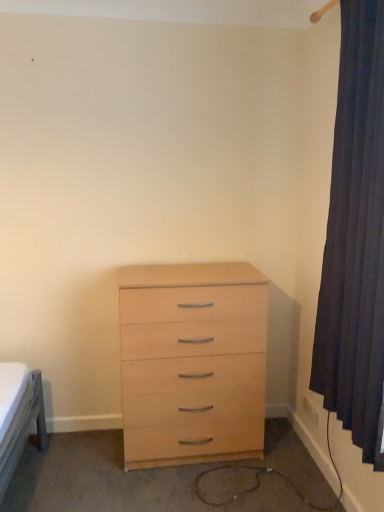
Question: Is light wood chest of drawers at center in front of or behind dark blue fabric curtain at right in the image?

Choices:
 (A) front
 (B) behind

Answer: (B)

Question: From the image's perspective, is light wood chest of drawers at center above or below dark blue fabric curtain at right?

Choices:
 (A) above
 (B) below

Answer: (B)

Question: From a real-world perspective, is light wood chest of drawers at center above or below dark blue fabric curtain at right?

Choices:
 (A) above
 (B) below

Answer: (B)

Question: From the image's perspective, relative to light wood chest of drawers at center, is dark blue fabric curtain at right above or below?

Choices:
 (A) below
 (B) above

Answer: (B)

Question: Is dark blue fabric curtain at right bigger or smaller than light wood chest of drawers at center?

Choices:
 (A) small
 (B) big

Answer: (A)

Question: Would you say dark blue fabric curtain at right is to the left or to the right of light wood chest of drawers at center in the picture?

Choices:
 (A) left
 (B) right

Answer: (B)

Question: Is point (x=345, y=381) closer or farther from the camera than point (x=142, y=285)?

Choices:
 (A) farther
 (B) closer

Answer: (B)